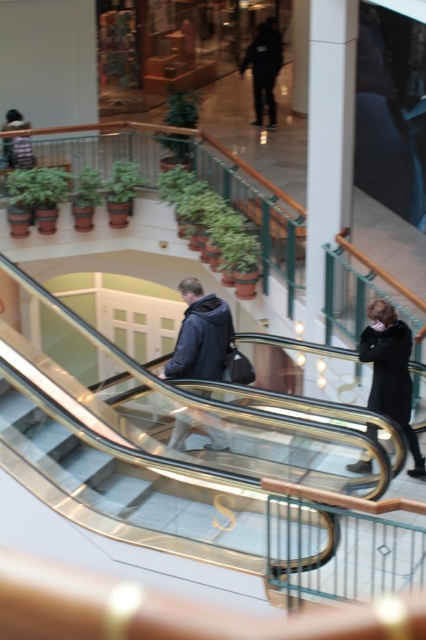
Based on the photo, can you confirm if dark blue jacket at center is wider than black wool coat at lower right?

Yes, dark blue jacket at center is wider than black wool coat at lower right.

In the scene shown: Is dark blue jacket at center above black wool coat at lower right?

Yes.

Locate an element on the screen. dark blue jacket at center is located at coordinates (201, 336).

Between point (25, 436) and point (187, 333), which one is positioned in front?

Point (25, 436) is in front.

Is point (100, 476) farther from camera compared to point (189, 336)?

No.

Between point (89, 515) and point (169, 445), which one is positioned in front?

Positioned in front is point (89, 515).

What are the coordinates of `transparent glass stairs at center` in the screenshot? It's located at (129, 493).

Image resolution: width=426 pixels, height=640 pixels. Describe the element at coordinates (129, 493) in the screenshot. I see `transparent glass stairs at center` at that location.

Which is more to the right, transparent glass stairs at center or black wool coat at lower right?

black wool coat at lower right is more to the right.

At what (x,y) coordinates should I click in order to perform the action: click on transparent glass stairs at center. Please return your answer as a coordinate pair (x, y). Looking at the image, I should click on (129, 493).